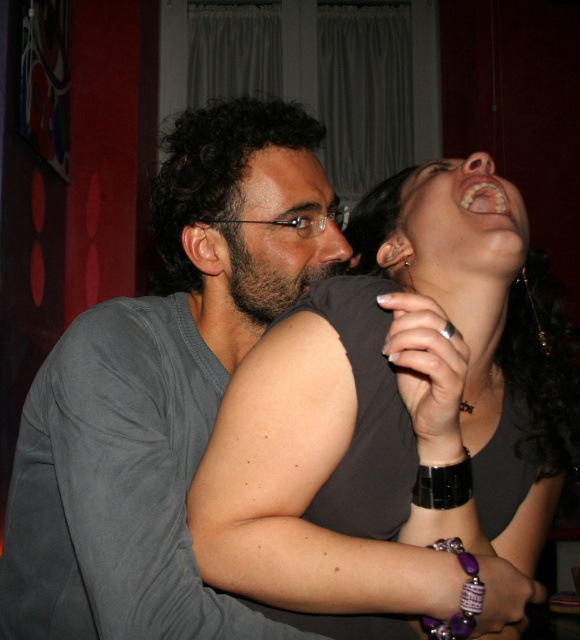
You are a photographer standing in front of the scene. You want to take a closeup shot of the gray matte shirt at center. What is the minimum distance you need to maintain to focus properly?

The gray matte shirt at center is 58.63 centimeters away from viewer, so the minimum distance to focus properly is 58.63 centimeters.

In the scene, there is a point labeled at coordinates (x=397, y=419). Based on the image description, which object does this point belong to?

The point at coordinates (x=397, y=419) is located on the matte gray tank top at center.

Looking at this image, you are a photographer adjusting a camera to focus on the matte gray tank top at center and the white glossy teeth at upper center in the image. Which object should you adjust the focus to first if you want to focus on the closer one?

The white glossy teeth at upper center are closer than the matte gray tank top at center, so you should adjust the focus to the white glossy teeth at upper center first.